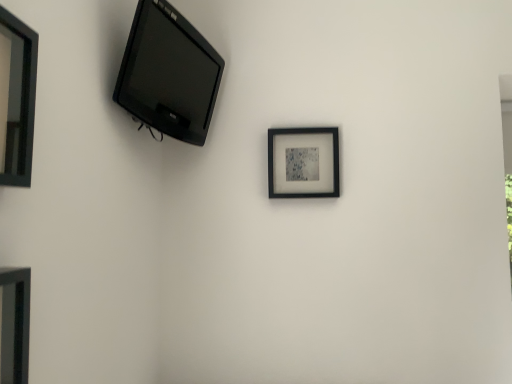
Question: From the image's perspective, is matte black tv at upper left beneath black glossy picture frame at upper left, marked as the 3th picture frame in a right-to-left arrangement?

Choices:
 (A) no
 (B) yes

Answer: (A)

Question: Does matte black tv at upper left appear on the left side of black glossy picture frame at upper left, which appears as the first picture frame when viewed from the left?

Choices:
 (A) yes
 (B) no

Answer: (B)

Question: Is matte black tv at upper left located outside black glossy picture frame at upper left, which appears as the 2th picture frame when viewed from the back?

Choices:
 (A) no
 (B) yes

Answer: (B)

Question: Is the position of matte black tv at upper left less distant than that of black glossy picture frame at upper left, which appears as the 2th picture frame when viewed from the back?

Choices:
 (A) yes
 (B) no

Answer: (B)

Question: Is matte black tv at upper left not close to black glossy picture frame at upper left, which appears as the 2th picture frame when viewed from the back?

Choices:
 (A) yes
 (B) no

Answer: (B)

Question: Can you confirm if matte black tv at upper left is smaller than black glossy picture frame at upper left, marked as the 3th picture frame in a right-to-left arrangement?

Choices:
 (A) no
 (B) yes

Answer: (A)

Question: Does matte black tv at upper left have a lesser height compared to matte black picture frame at lower left, which appears as the second picture frame when viewed from the right?

Choices:
 (A) yes
 (B) no

Answer: (B)

Question: From the image's perspective, would you say matte black tv at upper left is positioned over matte black picture frame at lower left, which is counted as the 1th picture frame, starting from the front?

Choices:
 (A) yes
 (B) no

Answer: (A)

Question: Considering the relative positions of matte black tv at upper left and matte black picture frame at lower left, which appears as the second picture frame when viewed from the right, in the image provided, is matte black tv at upper left in front of matte black picture frame at lower left, which appears as the second picture frame when viewed from the right,?

Choices:
 (A) yes
 (B) no

Answer: (B)

Question: Is matte black tv at upper left taller than matte black picture frame at lower left, marked as the 2th picture frame in a left-to-right arrangement?

Choices:
 (A) yes
 (B) no

Answer: (A)

Question: From a real-world perspective, is matte black tv at upper left over matte black picture frame at lower left, positioned as the third picture frame in back-to-front order?

Choices:
 (A) yes
 (B) no

Answer: (A)

Question: Are matte black tv at upper left and matte black picture frame at lower left, which appears as the second picture frame when viewed from the right, beside each other?

Choices:
 (A) no
 (B) yes

Answer: (A)

Question: Is black glossy picture frame at upper left, which appears as the 2th picture frame when viewed from the back, at the right side of black matte picture frame at center, positioned as the first picture frame in back-to-front order?

Choices:
 (A) yes
 (B) no

Answer: (B)